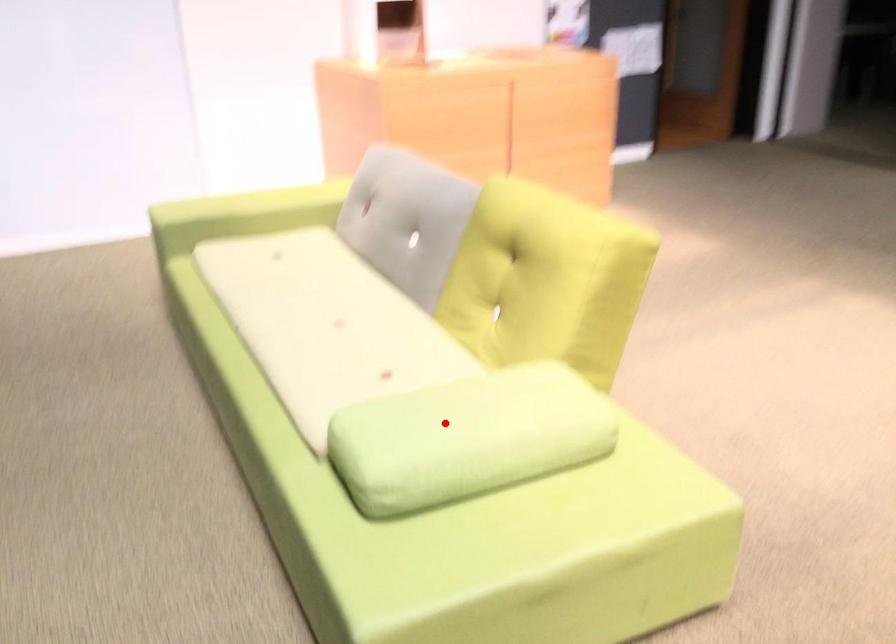
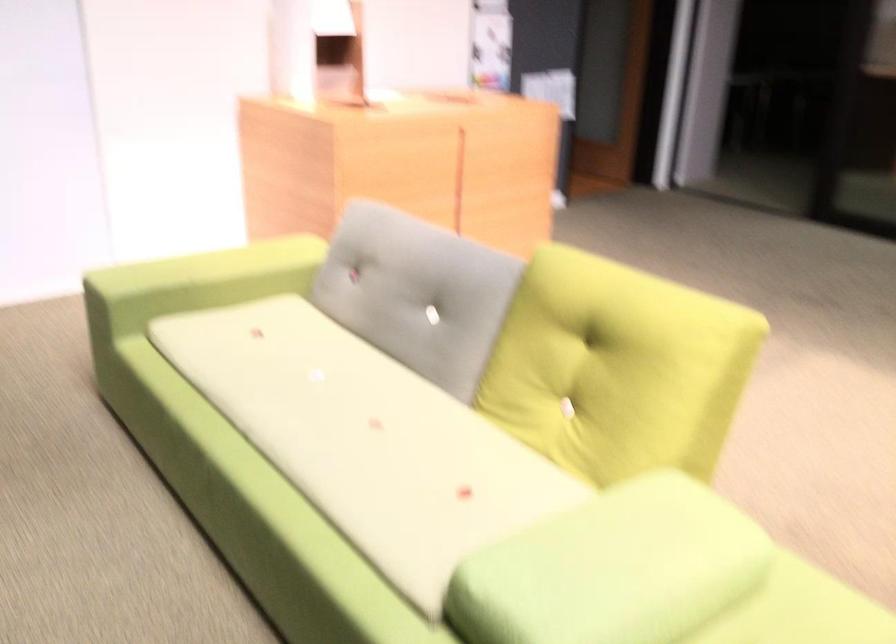
Question: I am providing you with two images of the same scene from different viewpoints. Image1 has a red point marked. In image2, the corresponding 3D location appears at what relative position? Reply with the corresponding letter.

Choices:
 (A) Closer
 (B) Farther

Answer: (A)